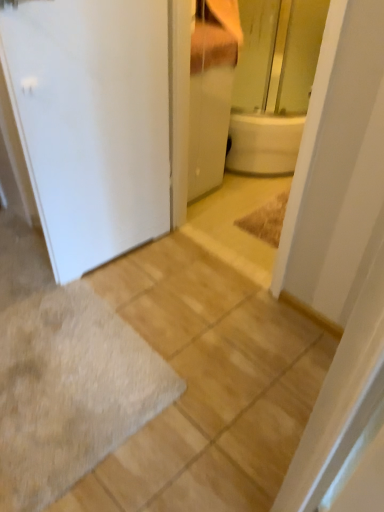
Question: From the image's perspective, is white matte door at left located above gray shaggy bath mat at lower left?

Choices:
 (A) yes
 (B) no

Answer: (A)

Question: Considering the relative sizes of white matte door at left and gray shaggy bath mat at lower left in the image provided, is white matte door at left wider than gray shaggy bath mat at lower left?

Choices:
 (A) no
 (B) yes

Answer: (A)

Question: Can you confirm if white matte door at left is thinner than gray shaggy bath mat at lower left?

Choices:
 (A) yes
 (B) no

Answer: (A)

Question: Is white matte door at left turned away from gray shaggy bath mat at lower left?

Choices:
 (A) no
 (B) yes

Answer: (A)

Question: Can you confirm if white matte door at left is smaller than gray shaggy bath mat at lower left?

Choices:
 (A) yes
 (B) no

Answer: (B)

Question: Is white matte door at left bigger than gray shaggy bath mat at lower left?

Choices:
 (A) yes
 (B) no

Answer: (A)

Question: From the image's perspective, is white glossy cabinet at upper center beneath white matte door at left?

Choices:
 (A) no
 (B) yes

Answer: (A)

Question: From the image's perspective, is white glossy cabinet at upper center on white matte door at left?

Choices:
 (A) no
 (B) yes

Answer: (B)

Question: Is white glossy cabinet at upper center next to white matte door at left and touching it?

Choices:
 (A) no
 (B) yes

Answer: (A)

Question: Would you say white glossy cabinet at upper center is a long distance from white matte door at left?

Choices:
 (A) yes
 (B) no

Answer: (B)

Question: Considering the relative positions of white glossy cabinet at upper center and white matte door at left in the image provided, is white glossy cabinet at upper center behind white matte door at left?

Choices:
 (A) no
 (B) yes

Answer: (B)

Question: Considering the relative sizes of white glossy cabinet at upper center and white matte door at left in the image provided, is white glossy cabinet at upper center bigger than white matte door at left?

Choices:
 (A) no
 (B) yes

Answer: (A)

Question: Can you confirm if gray shaggy bath mat at lower left is thinner than white matte door at left?

Choices:
 (A) no
 (B) yes

Answer: (A)